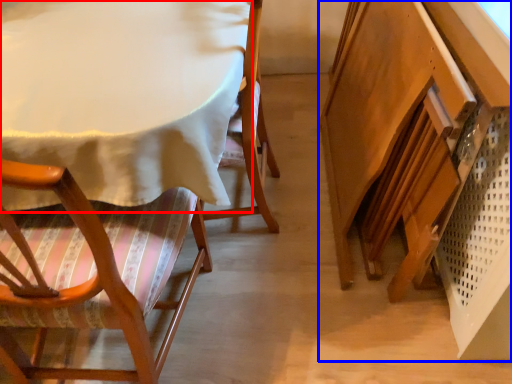
Question: Which object appears farthest to the camera in this image, table (highlighted by a red box) or vanity (highlighted by a blue box)?

Choices:
 (A) table
 (B) vanity

Answer: (A)